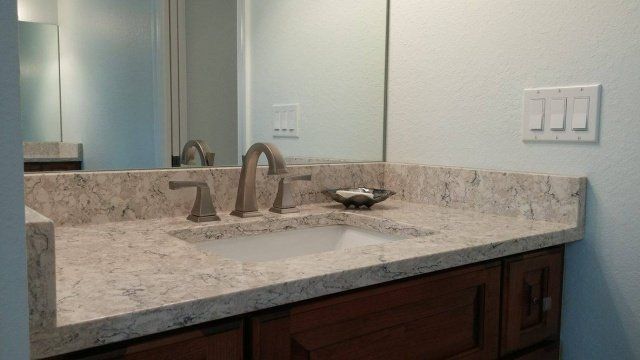
Identify the location of wall. Image resolution: width=640 pixels, height=360 pixels. (x=420, y=99).